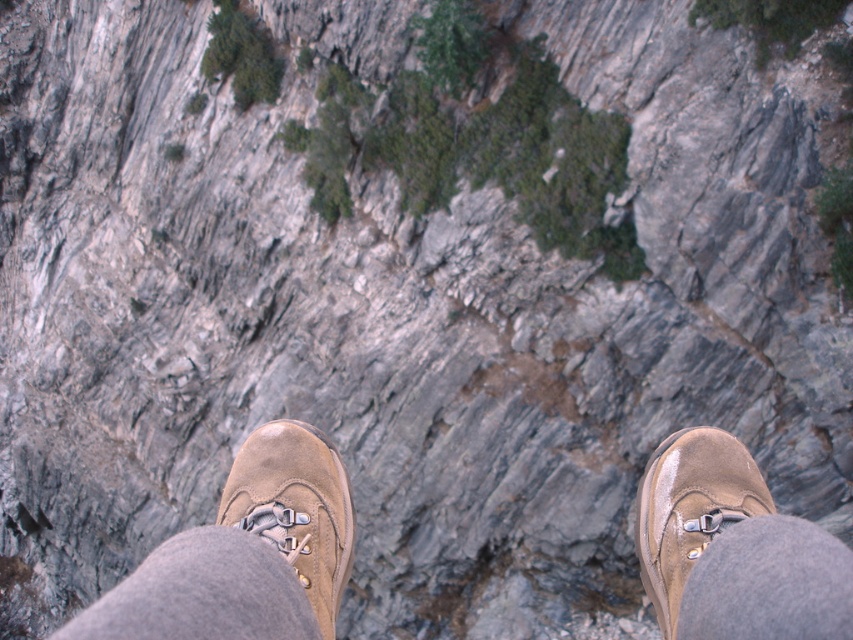
Question: Considering the real-world distances, which object is farthest from the brown suede shoe at center?

Choices:
 (A) brown suede shoes at center
 (B) brown suede shoe at lower right

Answer: (B)

Question: Is brown suede shoe at center further to the viewer compared to brown suede shoe at lower right?

Choices:
 (A) yes
 (B) no

Answer: (B)

Question: Which of these objects is positioned farthest from the brown suede shoe at center?

Choices:
 (A) brown suede shoes at center
 (B) brown suede shoe at lower right

Answer: (B)

Question: Is brown suede shoes at center in front of brown suede shoe at lower right?

Choices:
 (A) no
 (B) yes

Answer: (B)

Question: Which of the following is the closest to the observer?

Choices:
 (A) brown suede shoe at lower right
 (B) brown suede shoes at center
 (C) brown suede shoe at center

Answer: (B)

Question: Does brown suede shoe at center appear on the left side of brown suede shoe at lower right?

Choices:
 (A) yes
 (B) no

Answer: (A)